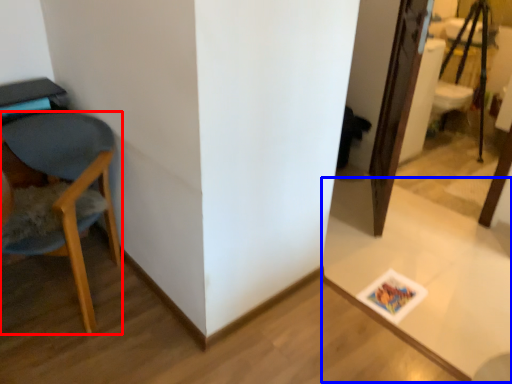
Question: Which of the following is the closest to the observer, chair (highlighted by a red box) or table (highlighted by a blue box)?

Choices:
 (A) chair
 (B) table

Answer: (A)